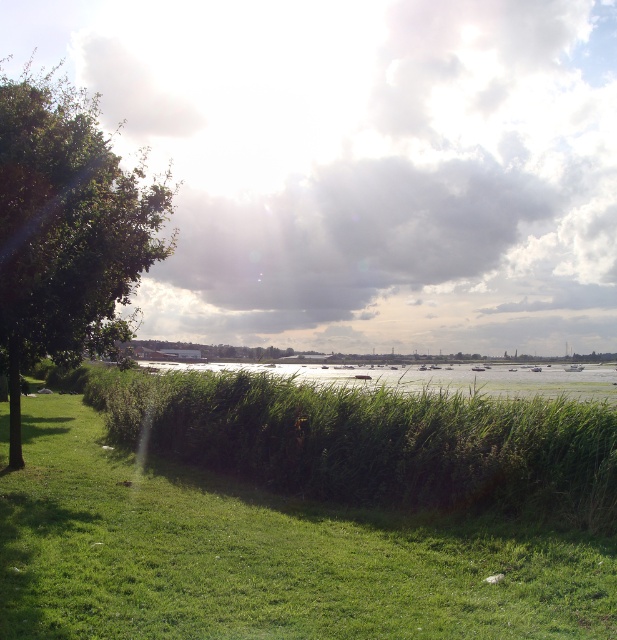
You are a gardener planning to trim both the green grassy hedge at center and the green leafy tree at left. Which of the two will require a ladder to reach the top?

The green leafy tree at left will require a ladder to reach the top since it is taller than the green grassy hedge at center.

You are standing at the riverside and want to take a photo of the green leafy tree at left. If your camera has a maximum zoom range of 10 meters, will you be able to capture the tree clearly without moving closer?

The green leafy tree at left is 8.66 meters away from viewer. Since the camera can zoom up to 10 meters, you can capture the tree clearly without moving closer.

Based on the photo, you are standing at the riverside and want to walk from the green leafy tree at left to the green grassy hedge at center. Which direction should you move to get closer to the hedge?

You should move towards the center because the green grassy hedge at center is closer to the viewer than the green leafy tree at left, meaning it is physically nearer in the scene.